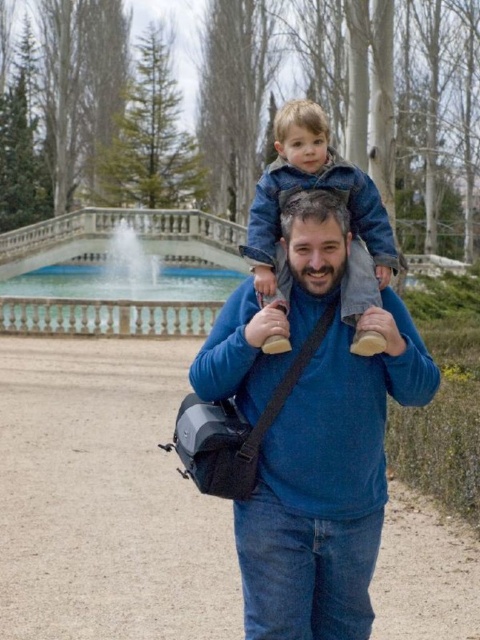
You are a photographer trying to capture a wide shot of the blue cotton sweater at center and the white marble fountain at center in the park. Your camera can focus on objects up to 20 meters apart. Will both subjects be within the camera focus range?

The blue cotton sweater at center and the white marble fountain at center are 17.56 meters apart, which is within the camera focus range of 20 meters. Therefore, both subjects will be in focus.

You are a photographer standing in the park scene. You want to take a photo of the two points mentioned. Which point is closer to you, point (112, 326) or point (384, 221)?

Point (112, 326) is further to the viewer than point (384, 221), so the closer point to you is point (384, 221).